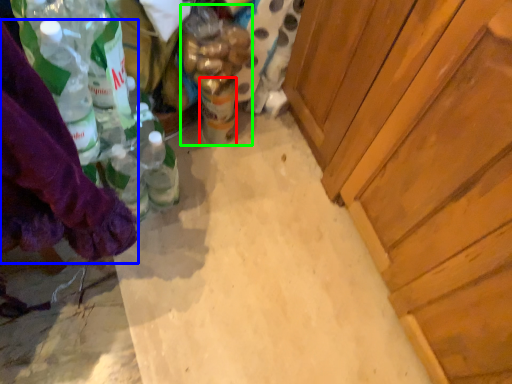
Question: Which is farther away from beverage (highlighted by a red box)? clothing (highlighted by a blue box) or bottle (highlighted by a green box)?

Choices:
 (A) clothing
 (B) bottle

Answer: (A)